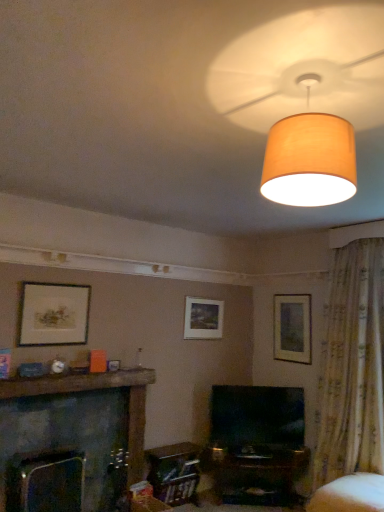
Question: In terms of height, does matte beige lampshade at upper center look taller or shorter compared to matte white picture frame at center, the second picture frame from the front?

Choices:
 (A) tall
 (B) short

Answer: (B)

Question: Do you think matte beige lampshade at upper center is within matte white picture frame at center, the 2th picture frame positioned from the right, or outside of it?

Choices:
 (A) outside
 (B) inside

Answer: (A)

Question: Estimate the real-world distances between objects in this image. Which object is farther from the white fabric swivel chair at lower right?

Choices:
 (A) dark gray stone fireplace at lower left
 (B) matte gold picture frame at left, the third picture frame positioned from the right
 (C) matte wooden picture frame at upper right, the 3th picture frame positioned from the left
 (D) matte beige lampshade at upper center
 (E) floral fabric curtain at right

Answer: (D)

Question: Based on their relative distances, which object is nearer to the matte white picture frame at center, which appears as the 2th picture frame when viewed from the back?

Choices:
 (A) dark gray stone fireplace at lower left
 (B) matte gold picture frame at left, the third picture frame positioned from the right
 (C) brown wooden mantle at lower left
 (D) matte wooden picture frame at upper right, arranged as the third picture frame when viewed from the front
 (E) matte beige lampshade at upper center

Answer: (D)